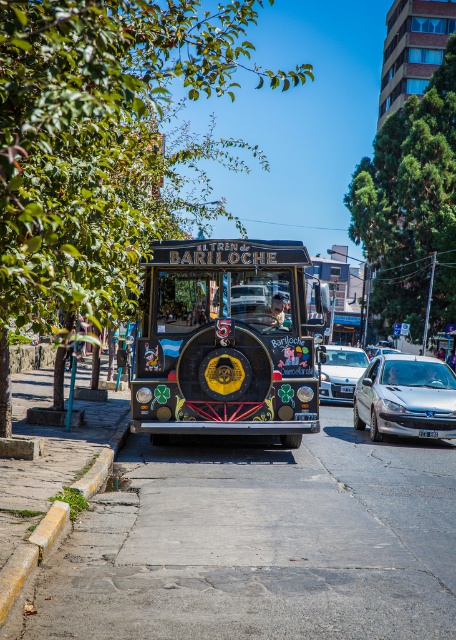
Based on the photo, is yellow concrete curb at lower left positioned at the back of silver metallic car at center?

No, yellow concrete curb at lower left is closer to the viewer.

Can you confirm if yellow concrete curb at lower left is positioned above silver metallic car at center?

No.

Between point (107, 472) and point (336, 372), which one is positioned in front?

Point (107, 472) is more forward.

Where is `yellow concrete curb at lower left`? The height and width of the screenshot is (640, 456). yellow concrete curb at lower left is located at coordinates (30, 554).

Between paved concrete sidewalk at center and yellow concrete curb at lower left, which one is positioned higher?

Positioned higher is yellow concrete curb at lower left.

Does paved concrete sidewalk at center appear over yellow concrete curb at lower left?

Actually, paved concrete sidewalk at center is below yellow concrete curb at lower left.

Image resolution: width=456 pixels, height=640 pixels. What do you see at coordinates (258, 544) in the screenshot?
I see `paved concrete sidewalk at center` at bounding box center [258, 544].

Locate an element on the screen. paved concrete sidewalk at center is located at coordinates (258, 544).

Can you confirm if silver metallic car at right is positioned above yellow concrete curb at lower left?

Yes.

You are a GUI agent. You are given a task and a screenshot of the screen. Output one action in this format:
    pyautogui.click(x=<x>, y=<y>)
    Task: Click on the silver metallic car at right
    Image resolution: width=456 pixels, height=640 pixels.
    Given the screenshot: What is the action you would take?
    pyautogui.click(x=405, y=397)

Locate an element on the screen. The image size is (456, 640). silver metallic car at right is located at coordinates 405,397.